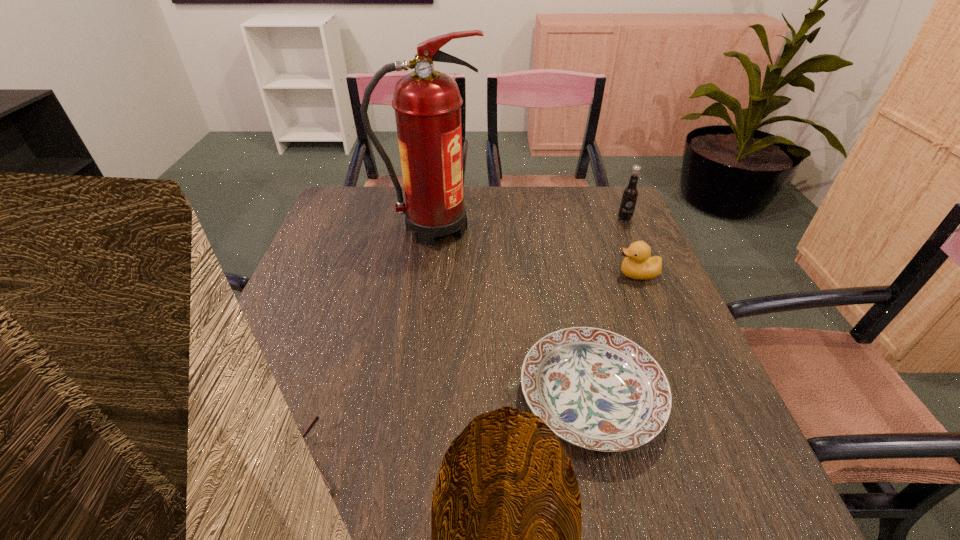
The image size is (960, 540). In order to click on vacant area that satisfies the following two spatial constraints: 1. on the label of the root beer; 2. on the face of the third shortest object in this screenshot , I will do `click(649, 274)`.